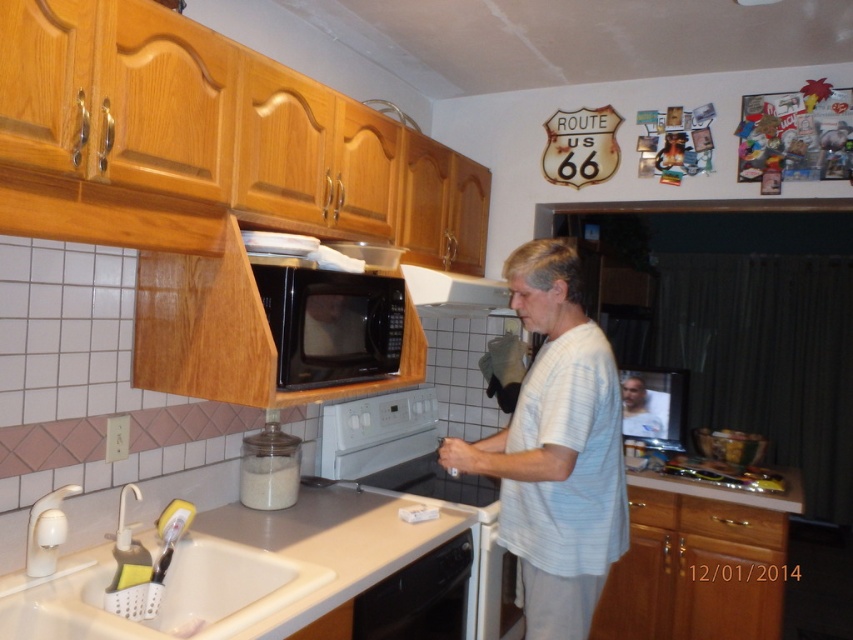
You are standing in the kitchen and want to place a dish in the white glossy oven at center. However, you first need to move a bowl from the black matte microwave at upper center. Which appliance should you reach for first, and why?

You should reach for the black matte microwave at upper center first because it is located above the white glossy oven at center, meaning it is positioned higher and closer to your upper body, making it easier to access before the oven below.

You are standing in the kitchen and want to reach both the point at (x=90, y=561) and the point at (x=379, y=445). Which point should you target first to reach the closer one?

You should target the point at (x=90, y=561) first because it is closer to you than the point at (x=379, y=445).

You are standing in the kitchen and notice two points marked in the scene. Which point, point (401, 634) or point (431, 298), is closer to you?

Point (401, 634) is closer to the viewer than point (431, 298).